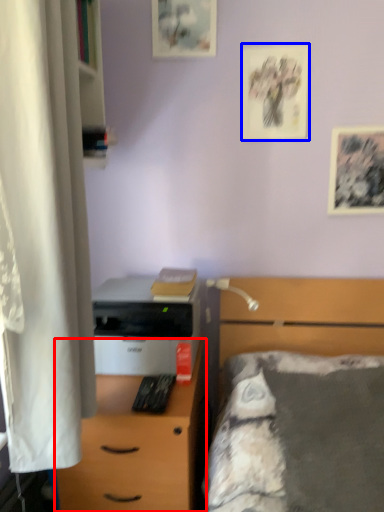
Question: Which object is closer to the camera taking this photo, desk (highlighted by a red box) or picture frame (highlighted by a blue box)?

Choices:
 (A) desk
 (B) picture frame

Answer: (A)